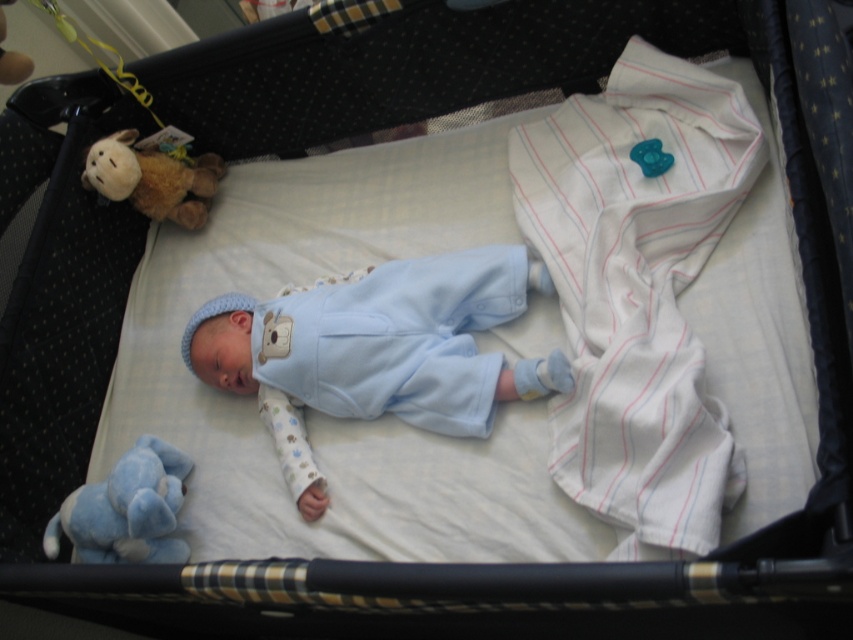
You are a parent checking on your baby in the crib. You notice two soft plush toys near the baby. Which plush toy is taller, the soft plush toy at lower left or the soft brown plush toy at upper left?

The soft plush toy at lower left is much taller than the soft brown plush toy at upper left.